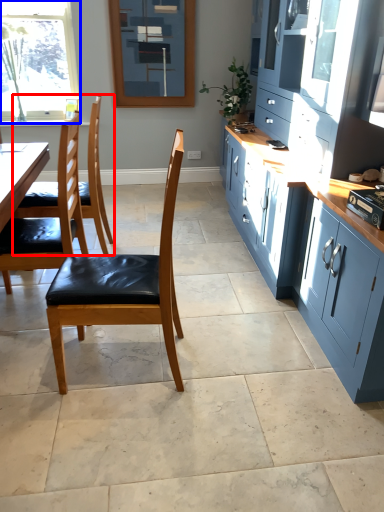
Question: Which object is further to the camera taking this photo, chair (highlighted by a red box) or window (highlighted by a blue box)?

Choices:
 (A) chair
 (B) window

Answer: (B)